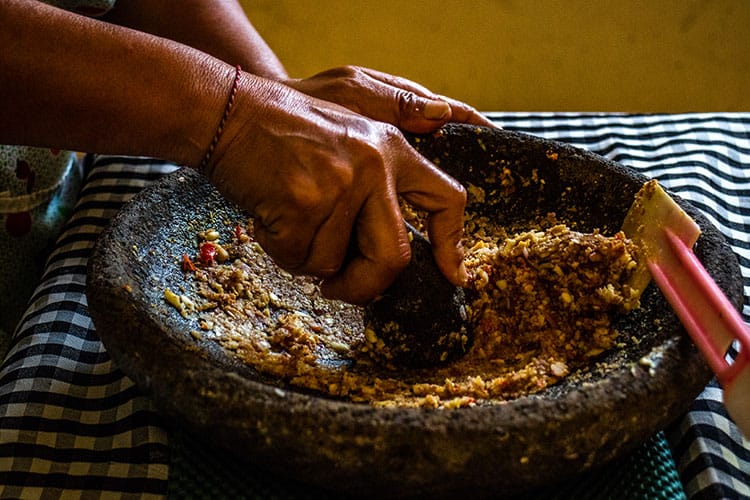
What are the coordinates of `wall` in the screenshot? It's located at (532, 57).